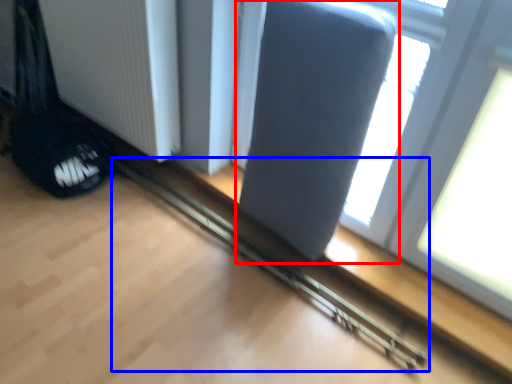
Question: Among these objects, which one is farthest to the camera, swivel chair (highlighted by a red box) or rail (highlighted by a blue box)?

Choices:
 (A) swivel chair
 (B) rail

Answer: (B)